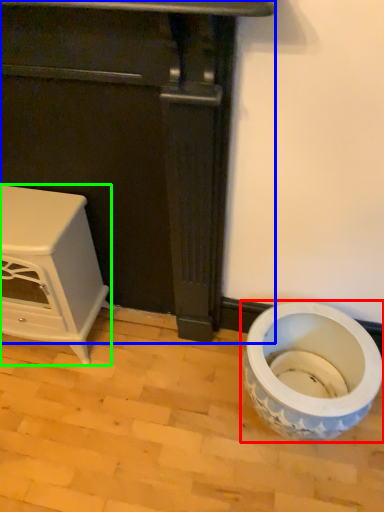
Question: Estimate the real-world distances between objects in this image. Which object is farther from toilet (highlighted by a red box), furniture (highlighted by a blue box) or furniture (highlighted by a green box)?

Choices:
 (A) furniture
 (B) furniture

Answer: (B)